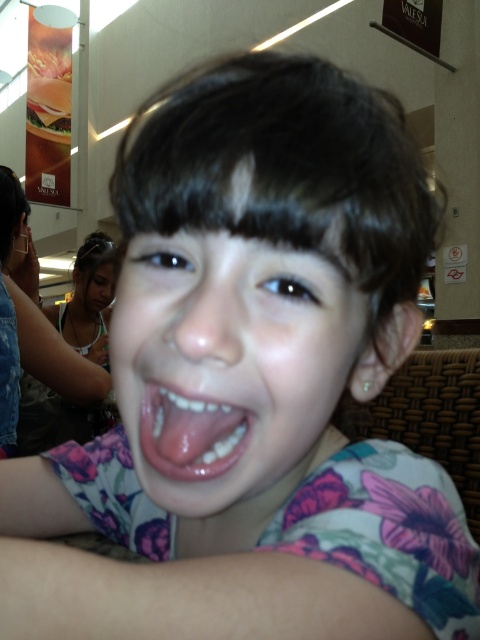
Question: Where is pink floral shirt at center located in relation to yellow cheeseburger at upper left in the image?

Choices:
 (A) right
 (B) left

Answer: (A)

Question: Which of the following is the closest to the observer?

Choices:
 (A) (152, 404)
 (B) (36, 365)
 (C) (101, 273)

Answer: (A)

Question: Which point appears farthest from the camera in this image?

Choices:
 (A) (320, 266)
 (B) (88, 300)
 (C) (41, 316)

Answer: (B)

Question: Does pink floral shirt at center lie behind yellow cheeseburger at upper left?

Choices:
 (A) no
 (B) yes

Answer: (A)

Question: Can you confirm if pink glossy tongue at center is bigger than matte skin face at upper left?

Choices:
 (A) yes
 (B) no

Answer: (B)

Question: Which of these objects is positioned farthest from the pink glossy tongue at center?

Choices:
 (A) yellow cheeseburger at upper left
 (B) floral fabric shirt at center

Answer: (A)